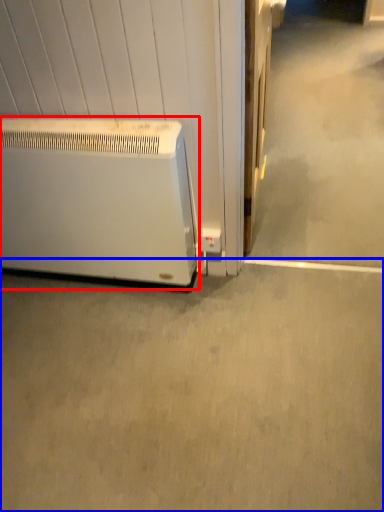
Question: Among these objects, which one is nearest to the camera, home appliance (highlighted by a red box) or concrete (highlighted by a blue box)?

Choices:
 (A) home appliance
 (B) concrete

Answer: (B)